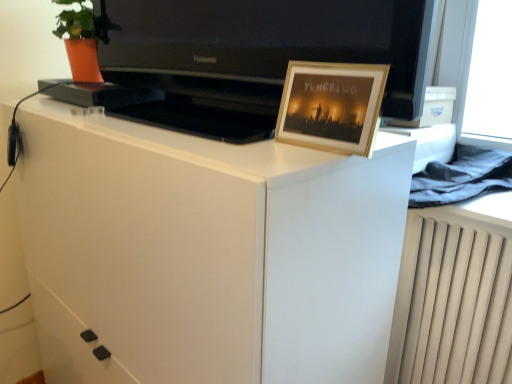
The image size is (512, 384). What do you see at coordinates (331, 106) in the screenshot? I see `wooden picture frame at upper right` at bounding box center [331, 106].

In order to face black glossy television at upper center, should I rotate leftwards or rightwards?

You should look left and rotate roughly 6.802 degrees.

I want to click on wooden picture frame at upper right, so click(331, 106).

Is white glossy cabinet at center touching black glossy television at upper center?

They are not placed beside each other.

Is point (91, 310) less distant than point (357, 6)?

Yes, it is.

Considering their positions, is white glossy cabinet at center located in front of or behind black glossy television at upper center?

Clearly, white glossy cabinet at center is behind black glossy television at upper center.

Considering the relative sizes of white glossy cabinet at center and black glossy television at upper center in the image provided, is white glossy cabinet at center wider than black glossy television at upper center?

Indeed, white glossy cabinet at center has a greater width compared to black glossy television at upper center.

Is black glossy television at upper center inside or outside of white glossy cabinet at center?

black glossy television at upper center is not enclosed by white glossy cabinet at center.

Looking at this image, can you confirm if black glossy television at upper center is positioned to the right of white glossy cabinet at center?

Correct, you'll find black glossy television at upper center to the right of white glossy cabinet at center.

Relative to white glossy cabinet at center, is black glossy television at upper center in front or behind?

black glossy television at upper center is in front of white glossy cabinet at center.

How distant is black glossy television at upper center from white glossy cabinet at center?

black glossy television at upper center and white glossy cabinet at center are 39.22 centimeters apart from each other.

Is wooden picture frame at upper right with black glossy television at upper center?

No, wooden picture frame at upper right is not next to black glossy television at upper center.

Considering the relative sizes of wooden picture frame at upper right and black glossy television at upper center in the image provided, is wooden picture frame at upper right bigger than black glossy television at upper center?

No, wooden picture frame at upper right is not bigger than black glossy television at upper center.

Can you tell me how much wooden picture frame at upper right and black glossy television at upper center differ in facing direction?

The angle between the facing direction of wooden picture frame at upper right and the facing direction of black glossy television at upper center is 0.79 degrees.

From the picture: Is wooden picture frame at upper right far away from white glossy cabinet at center?

No, wooden picture frame at upper right is not far away from white glossy cabinet at center.

What's the angular difference between wooden picture frame at upper right and white glossy cabinet at center's facing directions?

There is a 0.806-degree angle between the facing directions of wooden picture frame at upper right and white glossy cabinet at center.

Is wooden picture frame at upper right turned away from white glossy cabinet at center?

wooden picture frame at upper right does not have its back to white glossy cabinet at center.

At what (x,y) coordinates should I click in order to perform the action: click on picture frame above the white glossy cabinet at center (from a real-world perspective). Please return your answer as a coordinate pair (x, y). Looking at the image, I should click on (331, 106).

Which object is further away from the camera taking this photo, white glossy cabinet at center or wooden picture frame at upper right?

wooden picture frame at upper right is more distant.

Considering the relative sizes of white glossy cabinet at center and wooden picture frame at upper right in the image provided, is white glossy cabinet at center wider than wooden picture frame at upper right?

Indeed, white glossy cabinet at center has a greater width compared to wooden picture frame at upper right.

From a real-world perspective, who is located lower, white glossy cabinet at center or wooden picture frame at upper right?

From a 3D spatial view, white glossy cabinet at center is below.

Considering the sizes of objects white glossy cabinet at center and wooden picture frame at upper right in the image provided, who is bigger, white glossy cabinet at center or wooden picture frame at upper right?

white glossy cabinet at center.

Is there a large distance between black glossy television at upper center and wooden picture frame at upper right?

That's not correct — black glossy television at upper center is a little close to wooden picture frame at upper right.

What's the angular difference between black glossy television at upper center and wooden picture frame at upper right's facing directions?

The angle between the facing direction of black glossy television at upper center and the facing direction of wooden picture frame at upper right is 0.79 degrees.

From a real-world perspective, is black glossy television at upper center physically below wooden picture frame at upper right?

No, from a real-world perspective, black glossy television at upper center is not below wooden picture frame at upper right.

Identify the location of television in front of the white glossy cabinet at center. The image size is (512, 384). (265, 46).

I want to click on television that appears above the white glossy cabinet at center (from a real-world perspective), so click(x=265, y=46).

In the scene shown: Which object lies further to the anchor point white glossy cabinet at center, black glossy television at upper center or wooden picture frame at upper right?

Among the two, black glossy television at upper center is located further to white glossy cabinet at center.

Looking at the image, which one is located further to wooden picture frame at upper right, black glossy television at upper center or white glossy cabinet at center?

Among the two, black glossy television at upper center is located further to wooden picture frame at upper right.

When comparing their distances from white glossy cabinet at center, does wooden picture frame at upper right or black glossy television at upper center seem closer?

wooden picture frame at upper right is positioned closer to the anchor white glossy cabinet at center.

Estimate the real-world distances between objects in this image. Which object is further from black glossy television at upper center, white glossy cabinet at center or wooden picture frame at upper right?

white glossy cabinet at center.

Looking at the image, which one is located closer to wooden picture frame at upper right, white glossy cabinet at center or black glossy television at upper center?

Among the two, white glossy cabinet at center is located nearer to wooden picture frame at upper right.

Consider the image. Estimate the real-world distances between objects in this image. Which object is further from black glossy television at upper center, wooden picture frame at upper right or white glossy cabinet at center?

The object further to black glossy television at upper center is white glossy cabinet at center.

At what (x,y) coordinates should I click in order to perform the action: click on picture frame between black glossy television at upper center and white glossy cabinet at center vertically. Please return your answer as a coordinate pair (x, y). The width and height of the screenshot is (512, 384). Looking at the image, I should click on (331, 106).